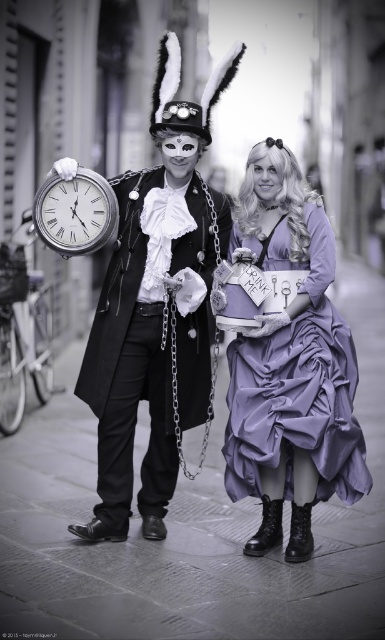
Question: Is matte black coat at center positioned at the back of lavender satin dress at center?

Choices:
 (A) no
 (B) yes

Answer: (B)

Question: Is lavender satin dress at center below silver metallic clock at center?

Choices:
 (A) no
 (B) yes

Answer: (B)

Question: Which point is farther from the camera taking this photo?

Choices:
 (A) (246, 376)
 (B) (105, 202)
 (C) (140, 284)

Answer: (C)

Question: Which object appears farthest from the camera in this image?

Choices:
 (A) matte black coat at center
 (B) silver metallic clock at center
 (C) lavender satin dress at center

Answer: (B)

Question: Among these objects, which one is farthest from the camera?

Choices:
 (A) matte black coat at center
 (B) lavender satin dress at center
 (C) silver metallic clock at center

Answer: (C)

Question: Is matte black coat at center below lavender satin dress at center?

Choices:
 (A) yes
 (B) no

Answer: (B)